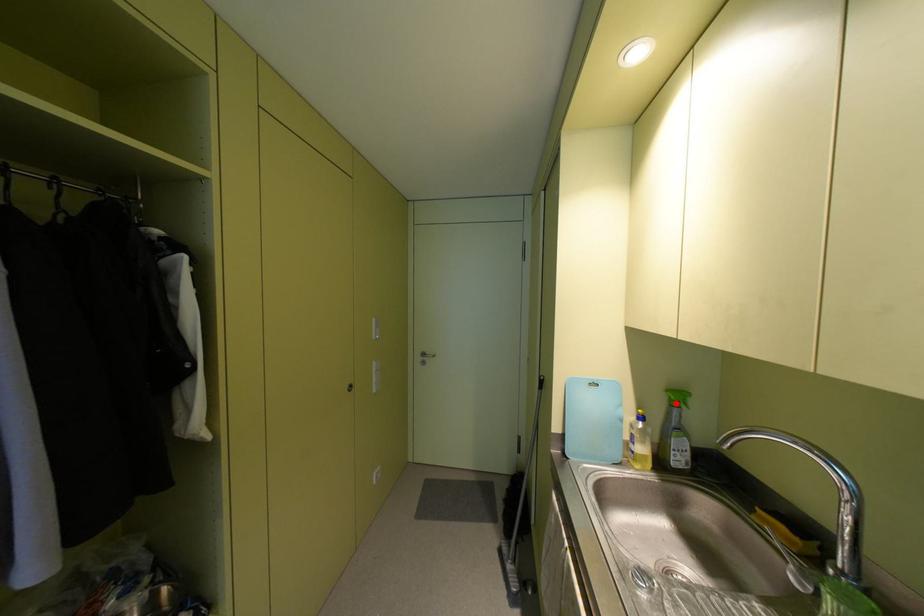
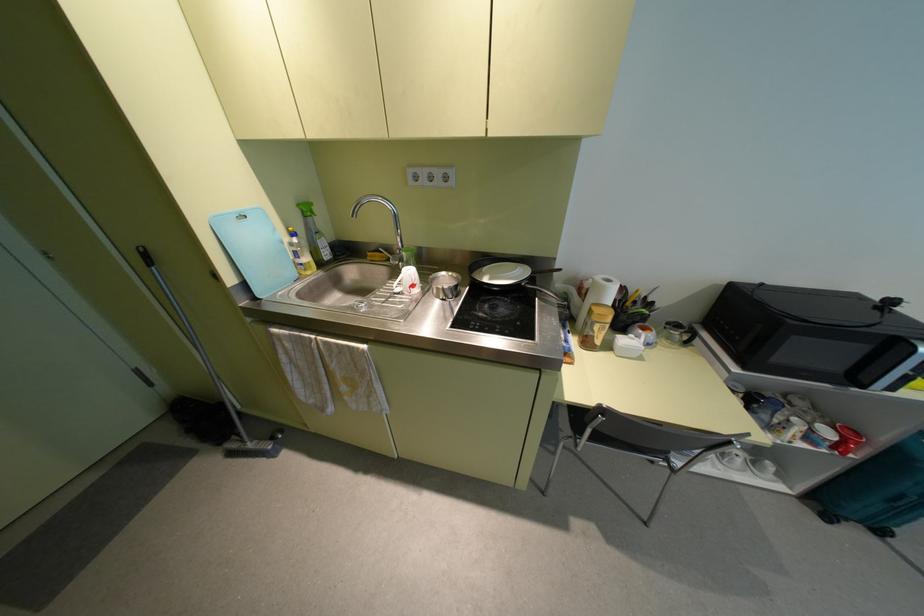
Find the pixel in the second image that matches the highlighted location in the first image.

(308, 214)